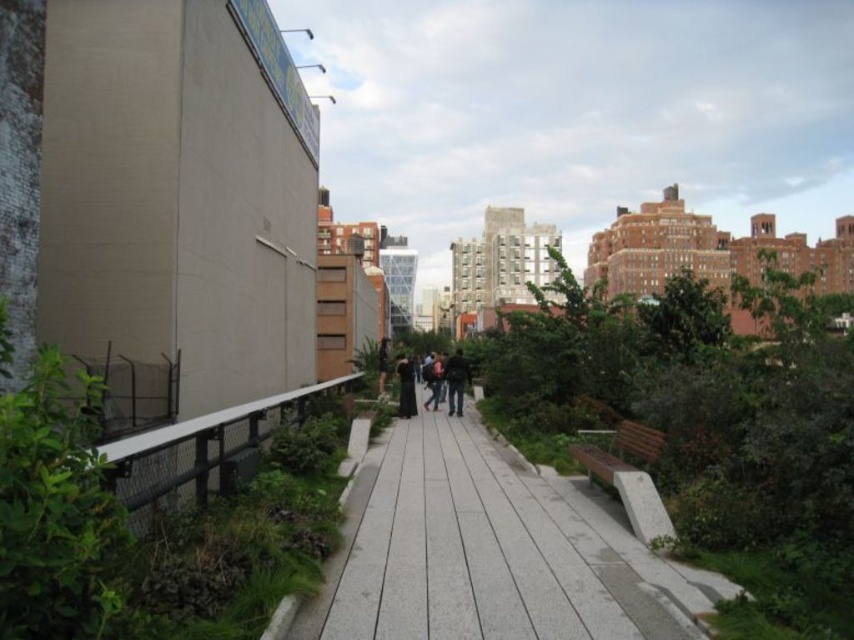
Can you confirm if black leather jacket at center is wider than dark gray backpack at center?

Yes, black leather jacket at center is wider than dark gray backpack at center.

Based on the photo, is black leather jacket at center smaller than dark gray backpack at center?

Incorrect, black leather jacket at center is not smaller in size than dark gray backpack at center.

I want to click on black leather jacket at center, so click(407, 387).

Identify the location of black leather jacket at center. (407, 387).

What do you see at coordinates (490, 552) in the screenshot? I see `gray concrete pavement at center` at bounding box center [490, 552].

How far apart are gray concrete pavement at center and dark gray backpack at center?

35.82 meters

Where is `gray concrete pavement at center`? Image resolution: width=854 pixels, height=640 pixels. gray concrete pavement at center is located at coordinates (490, 552).

Is gray concrete pavement at center smaller than black leather jacket at center?

Yes.

Does gray concrete pavement at center have a greater height compared to black leather jacket at center?

In fact, gray concrete pavement at center may be shorter than black leather jacket at center.

Locate an element on the screen. gray concrete pavement at center is located at coordinates (490, 552).

The image size is (854, 640). What are the coordinates of `gray concrete pavement at center` in the screenshot? It's located at (490, 552).